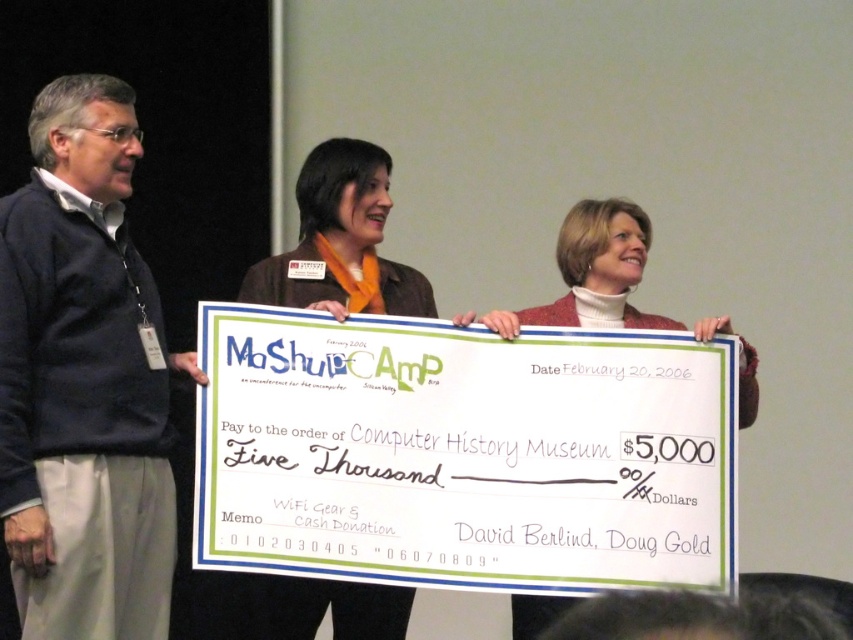
Question: Does white paper check at center appear on the left side of white turtleneck sweater at center?

Choices:
 (A) yes
 (B) no

Answer: (A)

Question: Based on their relative distances, which object is farther from the white turtleneck sweater at center?

Choices:
 (A) white paper check at center
 (B) dark blue sweater at left
 (C) brown leather jacket at center

Answer: (B)

Question: Among these points, which one is farthest from the camera?

Choices:
 (A) (78, 413)
 (B) (368, 184)
 (C) (363, 348)

Answer: (B)

Question: Which object is farther from the camera taking this photo?

Choices:
 (A) white turtleneck sweater at center
 (B) dark blue sweater at left

Answer: (A)

Question: Is brown leather jacket at center positioned behind white turtleneck sweater at center?

Choices:
 (A) no
 (B) yes

Answer: (B)

Question: Is brown leather jacket at center positioned at the back of white turtleneck sweater at center?

Choices:
 (A) yes
 (B) no

Answer: (A)